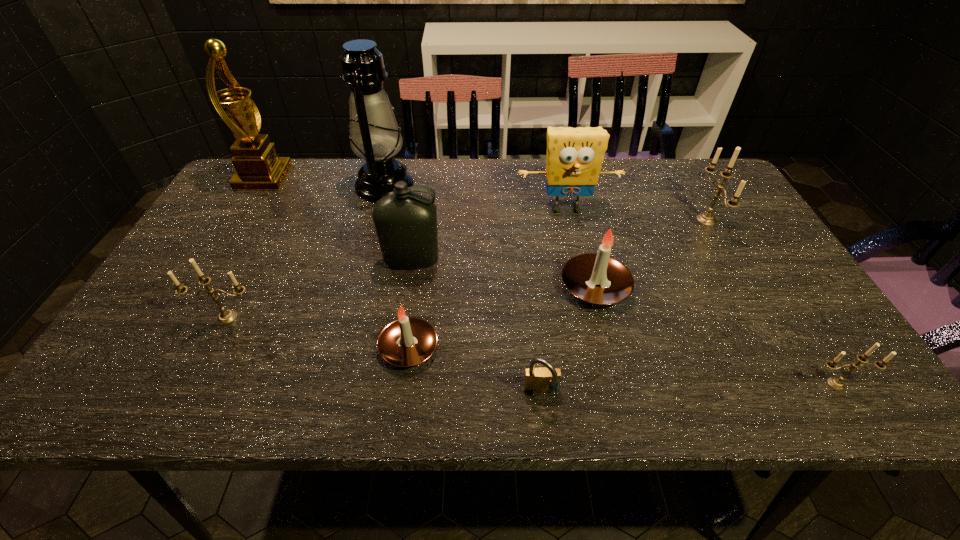
Locate an element on the screen. The width and height of the screenshot is (960, 540). free area in between the black oil lamp and the shortest object is located at coordinates (463, 289).

At what (x,y) coordinates should I click in order to perform the action: click on unoccupied area between the leftmost candle and the bigger white candle. Please return your answer as a coordinate pair (x, y). Looking at the image, I should click on (411, 302).

Identify the location of free spot between the farthest candle and the smallest metallic candle. pyautogui.click(x=771, y=302).

Image resolution: width=960 pixels, height=540 pixels. In order to click on blank region between the gold award and the shortest object in this screenshot , I will do `click(403, 286)`.

Identify the location of free spot between the nearer white candle and the sponge. (488, 278).

The height and width of the screenshot is (540, 960). I want to click on vacant area that lies between the shortest object and the sponge, so click(x=554, y=301).

Identify the location of free spot between the left white candle and the shortest object. (475, 370).

Identify the location of vacant region between the oil lamp and the right white candle. This screenshot has height=540, width=960. 490,236.

You are a GUI agent. You are given a task and a screenshot of the screen. Output one action in this format:
    pyautogui.click(x=<x>, y=<y>)
    Task: Click on the object that stands as the sixth closest to the tallest candle
    
    Given the screenshot: What is the action you would take?
    pyautogui.click(x=408, y=341)

Image resolution: width=960 pixels, height=540 pixels. Find the location of `object identified as the second closest to the bottle`. object identified as the second closest to the bottle is located at coordinates (374, 134).